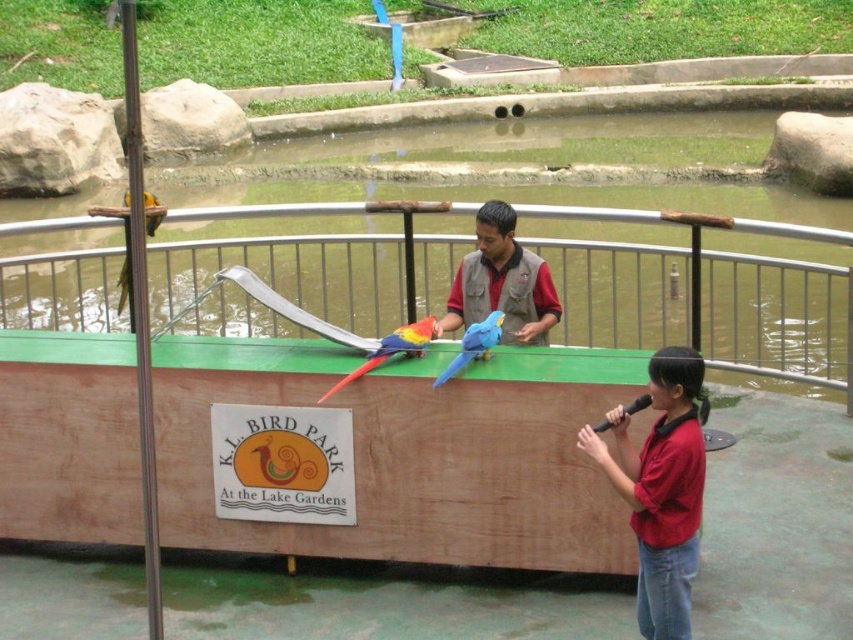
Does blue matte parrot at center appear over golden-yellow parrot at upper left?

Actually, blue matte parrot at center is below golden-yellow parrot at upper left.

Who is positioned more to the right, blue matte parrot at center or golden-yellow parrot at upper left?

blue matte parrot at center

Locate an element on the screen. This screenshot has width=853, height=640. blue matte parrot at center is located at coordinates (474, 344).

Is point (329, 396) positioned after point (486, 324)?

Yes, point (329, 396) is behind point (486, 324).

Does multicolored feathered parrot at center have a lesser height compared to blue matte parrot at center?

Incorrect, multicolored feathered parrot at center's height does not fall short of blue matte parrot at center's.

At what (x,y) coordinates should I click in order to perform the action: click on multicolored feathered parrot at center. Please return your answer as a coordinate pair (x, y). Looking at the image, I should click on 392,348.

Locate an element on the screen. This screenshot has width=853, height=640. multicolored feathered parrot at center is located at coordinates (392, 348).

Who is taller, red shirt vest at center or golden-yellow parrot at upper left?

With more height is golden-yellow parrot at upper left.

Identify the location of red shirt vest at center. The width and height of the screenshot is (853, 640). (502, 282).

Identify the location of red shirt vest at center. (502, 282).